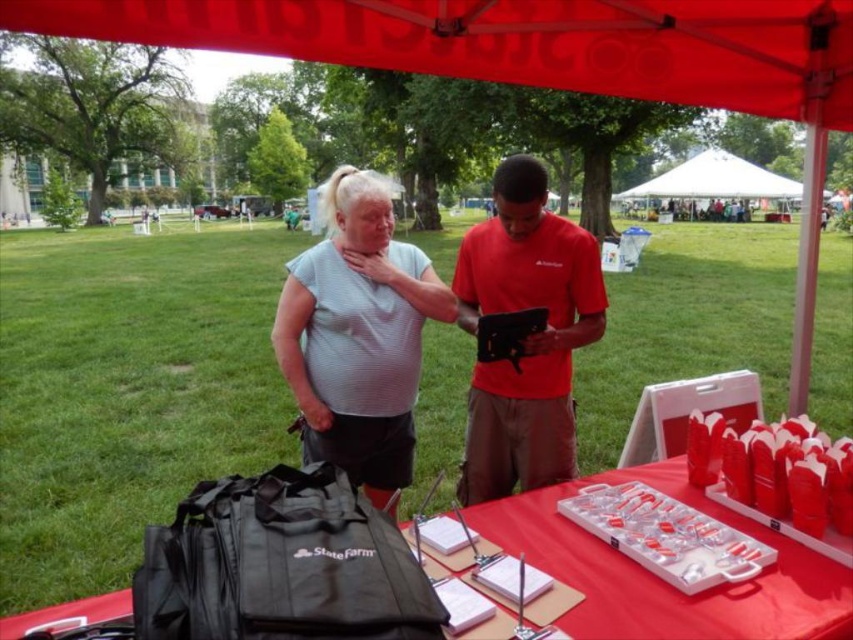
The image size is (853, 640). What are the coordinates of `gray striped shirt at center` in the screenshot? It's located at (358, 333).

Who is more forward, (312,360) or (544,253)?

Point (312,360) is in front.

Between point (381, 412) and point (564, 374), which one is positioned in front?

Positioned in front is point (381, 412).

Locate an element on the screen. This screenshot has width=853, height=640. gray striped shirt at center is located at coordinates (358, 333).

Measure the distance between red fabric canopy at upper center and gray striped shirt at center.

red fabric canopy at upper center is 39.17 inches away from gray striped shirt at center.

Does red fabric canopy at upper center appear on the right side of gray striped shirt at center?

Indeed, red fabric canopy at upper center is positioned on the right side of gray striped shirt at center.

Is point (583, 65) positioned in front of point (334, 170)?

Yes, point (583, 65) is closer to viewer.

Find the location of a particular element. This screenshot has height=640, width=853. red fabric canopy at upper center is located at coordinates (518, 42).

In the scene shown: Between gray striped shirt at center and red plastic tray at center, which one is positioned lower?

red plastic tray at center is below.

Describe the element at coordinates (358, 333) in the screenshot. The image size is (853, 640). I see `gray striped shirt at center` at that location.

Locate an element on the screen. gray striped shirt at center is located at coordinates (358, 333).